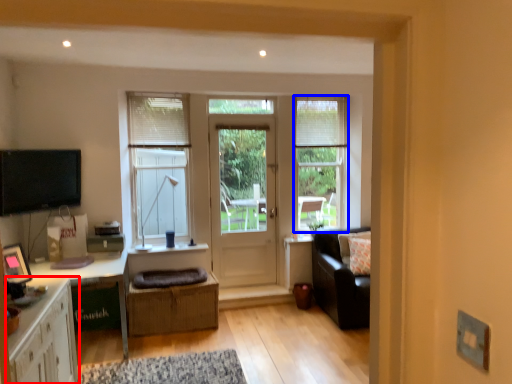
Question: Which point is further to the camera, cabinetry (highlighted by a red box) or window (highlighted by a blue box)?

Choices:
 (A) cabinetry
 (B) window

Answer: (B)